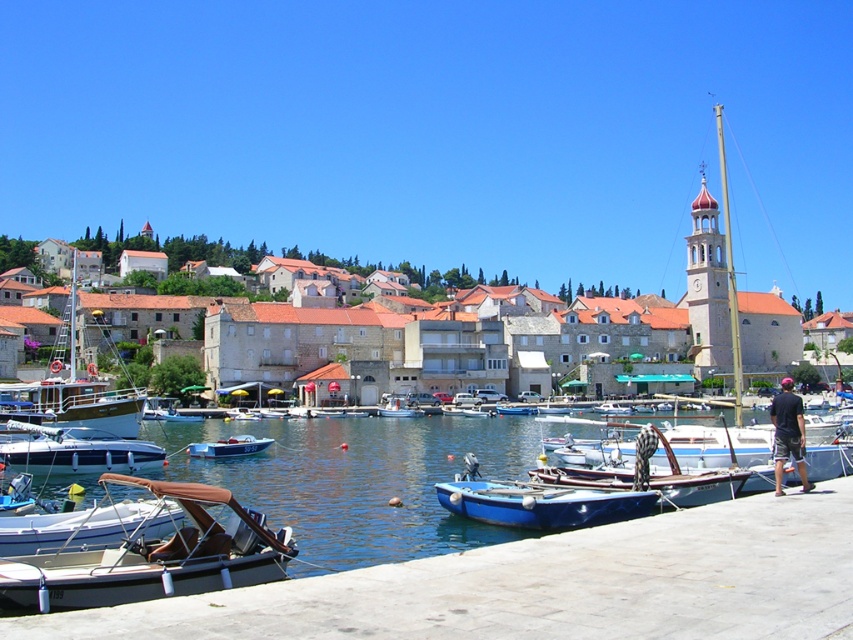
Question: Does white glossy boat at lower left appear on the left side of blue matte boat at center?

Choices:
 (A) no
 (B) yes

Answer: (B)

Question: Which is nearer to the matte stone buildings at center?

Choices:
 (A) metallic blue boat at lower left
 (B) brown canvas boat at lower left
 (C) wooden sailboat at left
 (D) blue smooth water at lower center

Answer: (D)

Question: Can you confirm if white glossy boat at lower left is positioned to the right of blue matte boat at center?

Choices:
 (A) no
 (B) yes

Answer: (A)

Question: Is matte stone buildings at center to the left of blue matte boat at center from the viewer's perspective?

Choices:
 (A) yes
 (B) no

Answer: (B)

Question: Which object is farther from the camera taking this photo?

Choices:
 (A) white glossy boat at lower left
 (B) wooden sailboat at left

Answer: (B)

Question: Which point is closer to the camera?

Choices:
 (A) (62, 422)
 (B) (78, 516)
 (C) (378, 458)

Answer: (B)